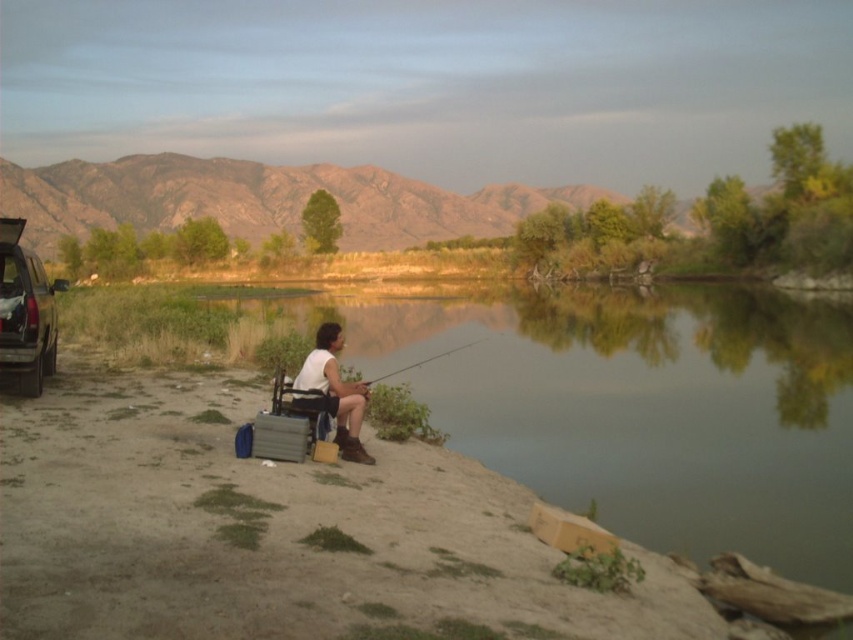
Is metallic silver suv at left taller than white matte shirt at center?

Yes.

Does metallic silver suv at left have a smaller size compared to white matte shirt at center?

No, metallic silver suv at left is not smaller than white matte shirt at center.

Identify the location of metallic silver suv at left. (25, 310).

Is point (358, 448) positioned before point (403, 368)?

Yes, point (358, 448) is closer to viewer.

Is point (351, 394) behind point (450, 352)?

No, (351, 394) is closer to viewer.

This screenshot has width=853, height=640. I want to click on white matte shirt at center, so click(x=334, y=392).

Is point (460, 316) positioned behind point (0, 266)?

That is True.

Does clear water at lower center have a larger size compared to metallic silver suv at left?

Incorrect, clear water at lower center is not larger than metallic silver suv at left.

I want to click on clear water at lower center, so click(635, 404).